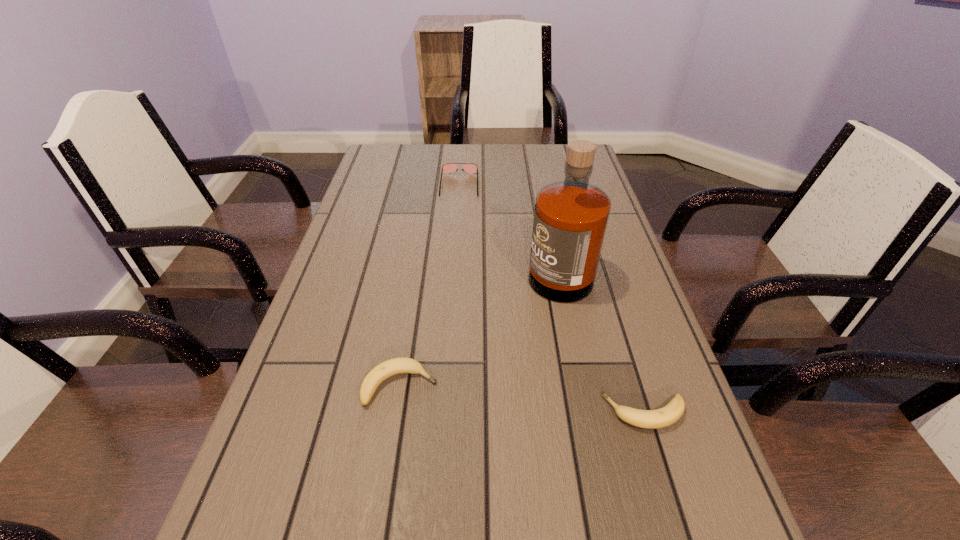
Locate an element on the screen. The height and width of the screenshot is (540, 960). the tallest object is located at coordinates (570, 221).

I want to click on liquor, so click(x=570, y=221).

Identify the location of the farthest object. The height and width of the screenshot is (540, 960). (447, 167).

The width and height of the screenshot is (960, 540). I want to click on sunglasses, so click(x=447, y=167).

Image resolution: width=960 pixels, height=540 pixels. I want to click on the left banana, so click(386, 369).

This screenshot has height=540, width=960. What are the coordinates of `the right banana` in the screenshot? It's located at pyautogui.click(x=651, y=419).

Where is `vacant position located 0.120m on the front label of the liquor`? Image resolution: width=960 pixels, height=540 pixels. vacant position located 0.120m on the front label of the liquor is located at coordinates 478,265.

You are a GUI agent. You are given a task and a screenshot of the screen. Output one action in this format:
    pyautogui.click(x=<x>, y=<y>)
    Task: Click on the vacant region located on the front label of the liquor
    The width and height of the screenshot is (960, 540).
    Given the screenshot: What is the action you would take?
    pyautogui.click(x=470, y=265)

You are a GUI agent. You are given a task and a screenshot of the screen. Output one action in this format:
    pyautogui.click(x=<x>, y=<y>)
    Task: Click on the vacant space located on the front label of the liquor
    The height and width of the screenshot is (540, 960).
    Given the screenshot: What is the action you would take?
    pyautogui.click(x=422, y=265)

The image size is (960, 540). In order to click on vacant space located on the bridge of the sunglasses in this screenshot , I will do `click(456, 234)`.